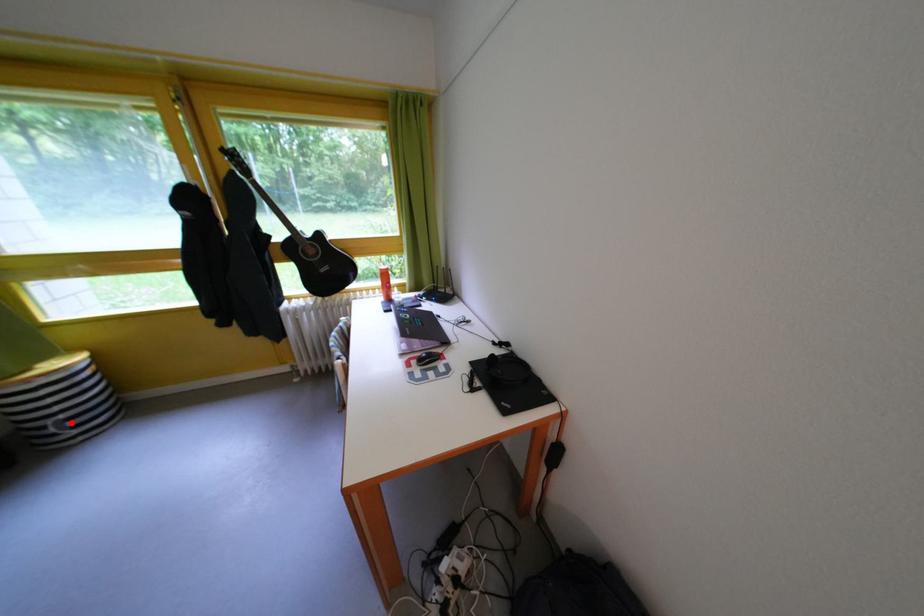
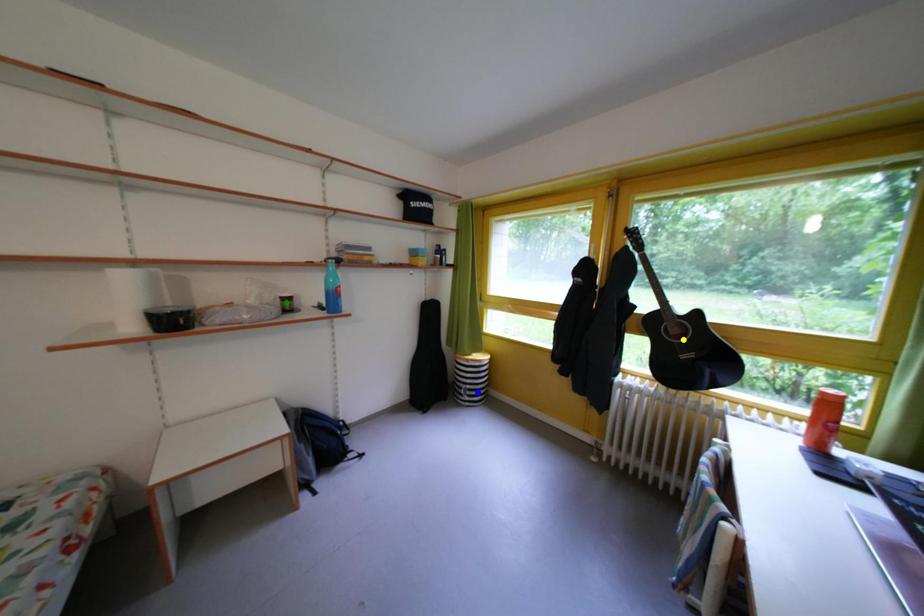
Question: I am providing you with two images of the same scene from different viewpoints. A red point is marked on the first image. You are given multiple points on the second image. Which spot in image 2 lines up with the point in image 1?

Choices:
 (A) yellow point
 (B) blue point
 (C) green point

Answer: (B)